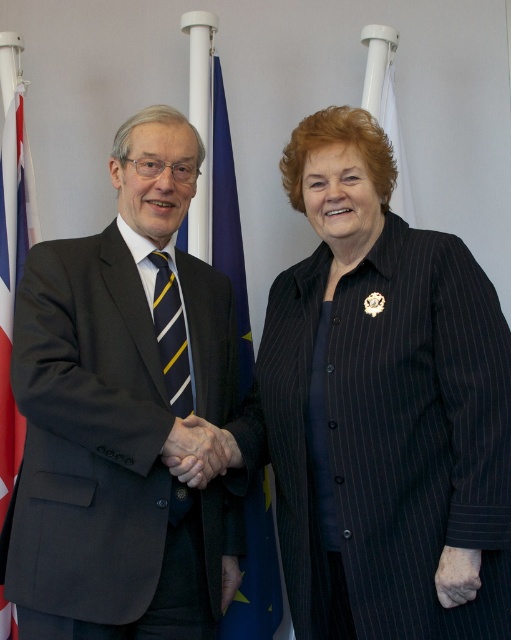
From the picture: Does blue fabric flag at center appear on the left side of yellow and blue striped tie at left?

Incorrect, blue fabric flag at center is not on the left side of yellow and blue striped tie at left.

Can you confirm if blue fabric flag at center is bigger than yellow and blue striped tie at left?

Yes, blue fabric flag at center is bigger than yellow and blue striped tie at left.

Is point (223, 202) positioned after point (174, 280)?

Yes, point (223, 202) is farther from viewer.

Locate an element on the screen. blue fabric flag at center is located at coordinates (228, 225).

Does point (175, 291) lie behind point (190, 420)?

Yes, point (175, 291) is farther from viewer.

Which is behind, point (181, 348) or point (190, 476)?

Point (181, 348)

Where is `yellow and blue striped tie at left`? yellow and blue striped tie at left is located at coordinates (172, 337).

Which is behind, point (63, 484) or point (267, 541)?

Positioned behind is point (267, 541).

Which is below, dark gray suit at left or blue fabric flag at center?

dark gray suit at left is below.

Is point (215, 365) farther from camera compared to point (223, 147)?

No.

Identify the location of dark gray suit at left. The image size is (511, 640). (123, 413).